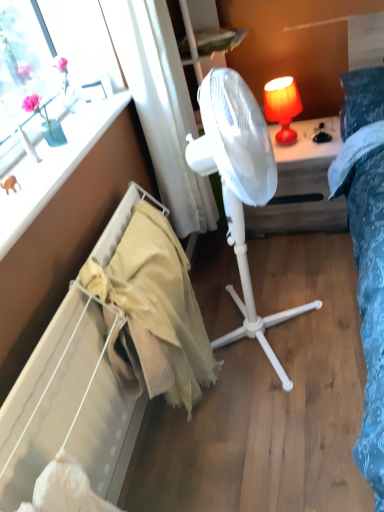
Where is `free location in front of white plastic fan at center`? The image size is (384, 512). free location in front of white plastic fan at center is located at coordinates (307, 259).